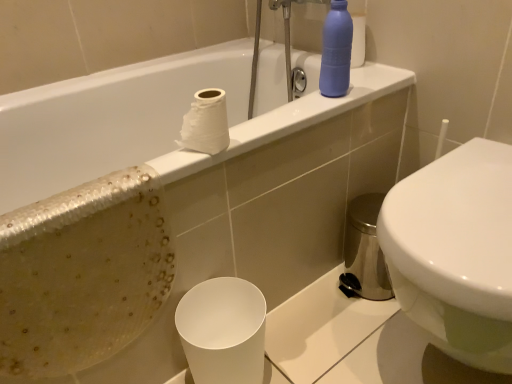
Question: Considering the positions of point (222, 109) and point (509, 261), is point (222, 109) closer or farther from the camera than point (509, 261)?

Choices:
 (A) farther
 (B) closer

Answer: (A)

Question: Is white matte toilet paper at upper center taller or shorter than white glossy toilet at right?

Choices:
 (A) short
 (B) tall

Answer: (A)

Question: Which is farther from the white matte paper cup at lower center?

Choices:
 (A) white glossy bathtub at upper center
 (B) matte blue bottle at upper right
 (C) white glossy toilet at right
 (D) white matte toilet paper at upper center

Answer: (B)

Question: Which of these objects is positioned farthest from the white matte paper cup at lower center?

Choices:
 (A) white matte toilet paper at upper center
 (B) matte blue bottle at upper right
 (C) white glossy toilet at right
 (D) white glossy bathtub at upper center

Answer: (B)